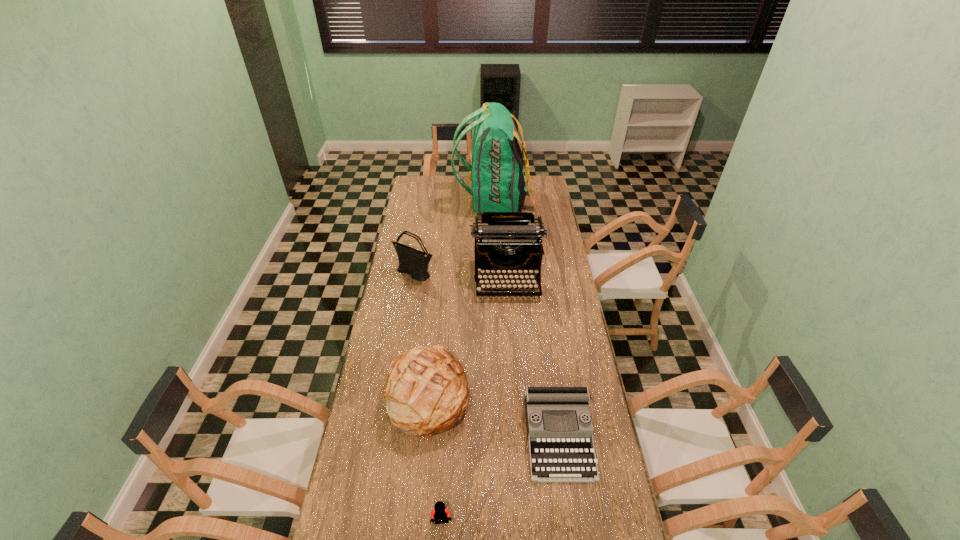
Image resolution: width=960 pixels, height=540 pixels. In order to click on free region at the left edge in this screenshot , I will do `click(421, 208)`.

Image resolution: width=960 pixels, height=540 pixels. Identify the location of vacant space at the far right corner of the desktop. (541, 187).

This screenshot has height=540, width=960. I want to click on vacant area that lies between the taller typewriter and the shorter typewriter, so (533, 357).

Where is `free spot between the nearest object and the bread`? Image resolution: width=960 pixels, height=540 pixels. free spot between the nearest object and the bread is located at coordinates click(x=435, y=457).

I want to click on vacant space that's between the farthest object and the shorter typewriter, so click(x=526, y=319).

The width and height of the screenshot is (960, 540). Identify the location of free space between the nearer typewriter and the bread. (492, 415).

At what (x,y) coordinates should I click in order to perform the action: click on free space between the tallest object and the nearest object. Please return your answer as a coordinate pair (x, y). Looking at the image, I should click on (468, 361).

This screenshot has width=960, height=540. Find the location of `vacant point located between the shoulder bag and the fourth tallest object`. vacant point located between the shoulder bag and the fourth tallest object is located at coordinates (421, 333).

Choose which object is the fourth nearest neighbor to the taller typewriter. Please provide its 2D coordinates. Your answer should be formatted as a tuple, i.e. [(x, y)], where the tuple contains the x and y coordinates of a point satisfying the conditions above.

[(559, 427)]

Where is `object that can be found as the third closest to the bread`? The image size is (960, 540). object that can be found as the third closest to the bread is located at coordinates (507, 242).